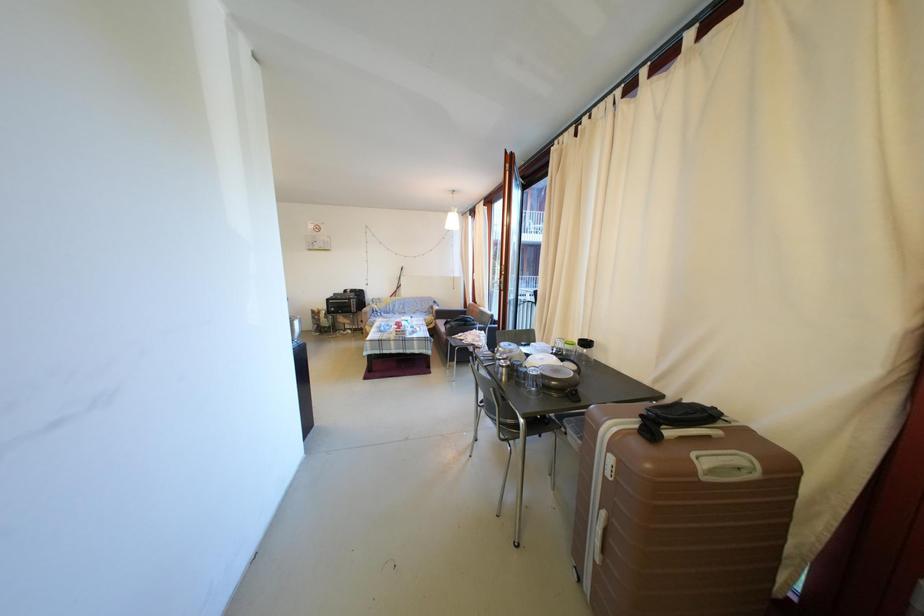
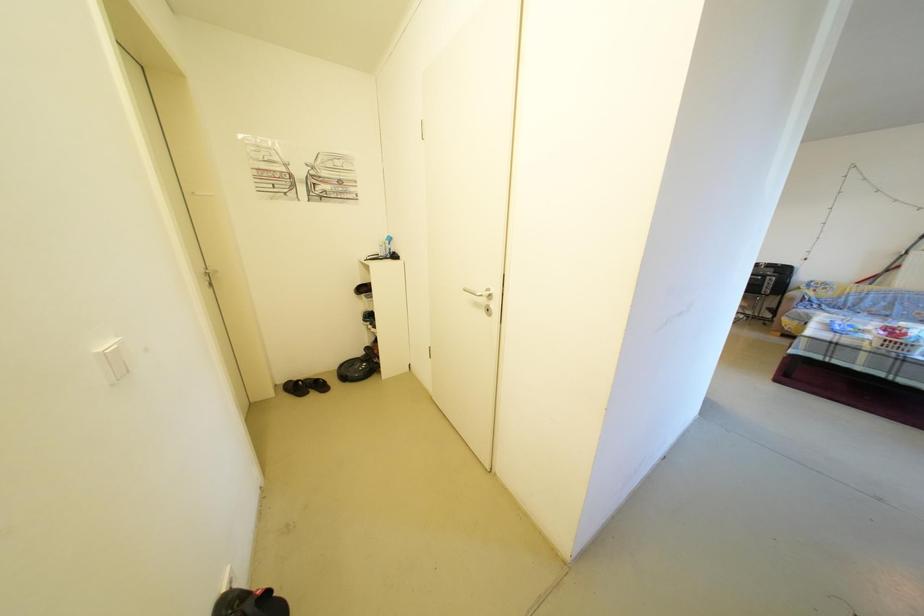
Question: The first image is from the beginning of the video and the second image is from the end. How did the camera likely rotate when shooting the video?

Choices:
 (A) Left
 (B) Right
 (C) Up
 (D) Down

Answer: (A)